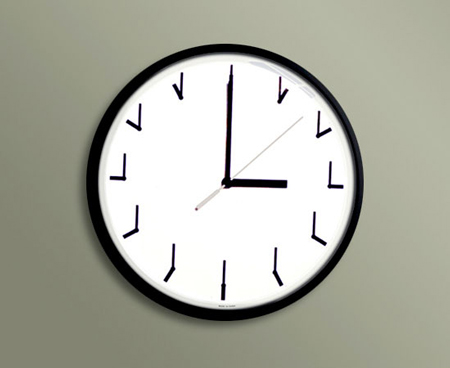
Where is `rim of clock`? rim of clock is located at coordinates (359, 198).